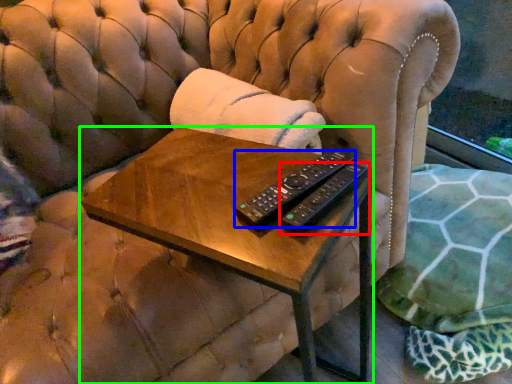
Question: Considering the real-world distances, which object is farthest from remote control (highlighted by a red box)? remote control (highlighted by a blue box) or table (highlighted by a green box)?

Choices:
 (A) remote control
 (B) table

Answer: (B)